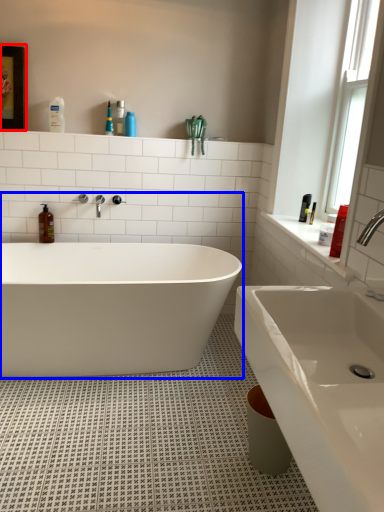
Question: Among these objects, which one is nearest to the camera, medicine cabinet (highlighted by a red box) or bathtub (highlighted by a blue box)?

Choices:
 (A) medicine cabinet
 (B) bathtub

Answer: (B)